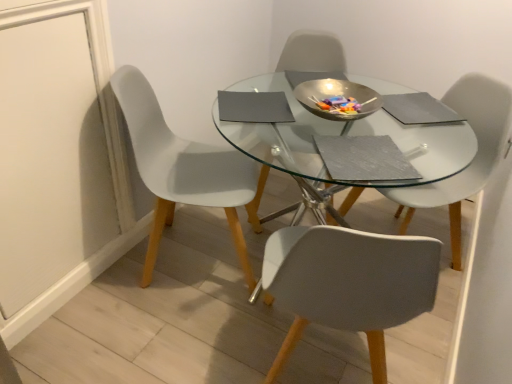
Question: Considering the relative sizes of white plastic chair at center, which is counted as the 1th chair, starting from the right, and matte gray chair at center, positioned as the 2th chair in right-to-left order, in the image provided, is white plastic chair at center, which is counted as the 1th chair, starting from the right, thinner than matte gray chair at center, positioned as the 2th chair in right-to-left order,?

Choices:
 (A) yes
 (B) no

Answer: (A)

Question: Are white plastic chair at center, which is counted as the 1th chair, starting from the right, and matte gray chair at center, which ranks as the second chair in left-to-right order, far apart?

Choices:
 (A) no
 (B) yes

Answer: (A)

Question: Can you confirm if white plastic chair at center, which is counted as the 1th chair, starting from the right, is smaller than matte gray chair at center, which ranks as the second chair in left-to-right order?

Choices:
 (A) no
 (B) yes

Answer: (B)

Question: Is white plastic chair at center, which is counted as the 1th chair, starting from the right, closer to the viewer compared to matte gray chair at center, which ranks as the second chair in left-to-right order?

Choices:
 (A) no
 (B) yes

Answer: (B)

Question: From a real-world perspective, does white plastic chair at center, which is counted as the 1th chair, starting from the right, sit lower than matte gray chair at center, positioned as the 2th chair in right-to-left order?

Choices:
 (A) no
 (B) yes

Answer: (B)

Question: Considering the relative positions of white plastic chair at center, the 3th chair when ordered from left to right, and matte gray chair at center, which ranks as the second chair in left-to-right order, in the image provided, is white plastic chair at center, the 3th chair when ordered from left to right, to the left of matte gray chair at center, which ranks as the second chair in left-to-right order, from the viewer's perspective?

Choices:
 (A) yes
 (B) no

Answer: (B)

Question: Is white plastic chair at left, which ranks as the 1th chair in left-to-right order, closer to the viewer compared to transparent glass table at center?

Choices:
 (A) yes
 (B) no

Answer: (B)

Question: From the image's perspective, is white plastic chair at left, the third chair positioned from the right, below transparent glass table at center?

Choices:
 (A) no
 (B) yes

Answer: (A)

Question: Can we say white plastic chair at left, which ranks as the 1th chair in left-to-right order, lies outside transparent glass table at center?

Choices:
 (A) no
 (B) yes

Answer: (A)

Question: Considering the relative sizes of white plastic chair at left, the third chair positioned from the right, and transparent glass table at center in the image provided, is white plastic chair at left, the third chair positioned from the right, smaller than transparent glass table at center?

Choices:
 (A) yes
 (B) no

Answer: (A)

Question: Can you confirm if white plastic chair at left, the third chair positioned from the right, is positioned to the right of transparent glass table at center?

Choices:
 (A) no
 (B) yes

Answer: (A)

Question: Considering the relative positions of white plastic chair at left, which ranks as the 1th chair in left-to-right order, and transparent glass table at center in the image provided, is white plastic chair at left, which ranks as the 1th chair in left-to-right order, behind transparent glass table at center?

Choices:
 (A) yes
 (B) no

Answer: (A)

Question: Considering the relative sizes of matte gray chair at center, which ranks as the second chair in left-to-right order, and white plastic chair at left, which ranks as the 1th chair in left-to-right order, in the image provided, is matte gray chair at center, which ranks as the second chair in left-to-right order, bigger than white plastic chair at left, which ranks as the 1th chair in left-to-right order,?

Choices:
 (A) no
 (B) yes

Answer: (A)